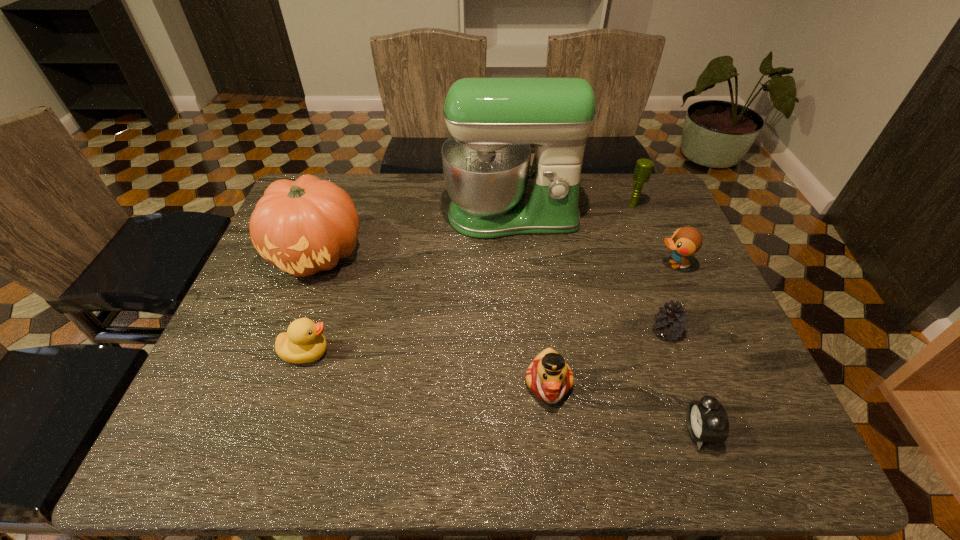
Where is `object present at the near right corner`? This screenshot has height=540, width=960. object present at the near right corner is located at coordinates (707, 421).

Locate an element on the screen. The image size is (960, 540). vacant region at the far edge is located at coordinates (440, 195).

You are a GUI agent. You are given a task and a screenshot of the screen. Output one action in this format:
    pyautogui.click(x=<x>, y=<y>)
    Task: Click on the free space at the near edge of the desktop
    
    Given the screenshot: What is the action you would take?
    pyautogui.click(x=287, y=428)

Locate an element on the screen. Image resolution: width=960 pixels, height=540 pixels. vacant space at the right edge of the desktop is located at coordinates (655, 254).

This screenshot has width=960, height=540. In order to click on vacant space that's between the farthest duck and the second duck from right to left in this screenshot , I will do `click(611, 324)`.

You are a GUI agent. You are given a task and a screenshot of the screen. Output one action in this format:
    pyautogui.click(x=<x>, y=<y>)
    Task: Click on the blank region between the second duck from right to left and the farthest duck
    The image size is (960, 540).
    Given the screenshot: What is the action you would take?
    pyautogui.click(x=611, y=324)

You are a GUI agent. You are given a task and a screenshot of the screen. Output one action in this format:
    pyautogui.click(x=<x>, y=<y>)
    Task: Click on the free space between the second duck from left to right and the pinecone
    The height and width of the screenshot is (540, 960).
    Given the screenshot: What is the action you would take?
    pyautogui.click(x=608, y=357)

Find the location of `vacant region between the leftmost duck and the pinecone`. vacant region between the leftmost duck and the pinecone is located at coordinates point(487,342).

In order to click on free spot between the rightmost duck and the second duck from left to right in this screenshot , I will do coord(611,324).

At what (x,y) coordinates should I click in order to perform the action: click on vacant area that lies between the farthest duck and the alarm clock. Please return your answer as a coordinate pair (x, y). The height and width of the screenshot is (540, 960). Looking at the image, I should click on (686, 348).